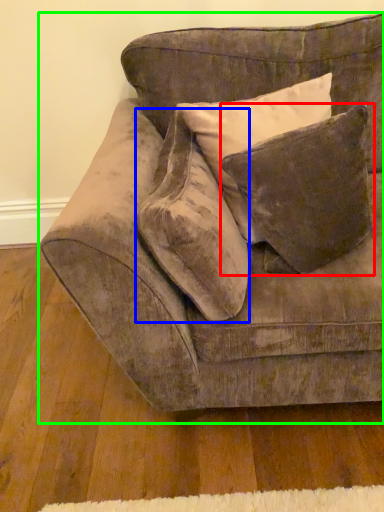
Question: Which object is the farthest from pillow (highlighted by a red box)? Choose among these: throw pillow (highlighted by a blue box) or studio couch (highlighted by a green box).

Choices:
 (A) throw pillow
 (B) studio couch

Answer: (B)